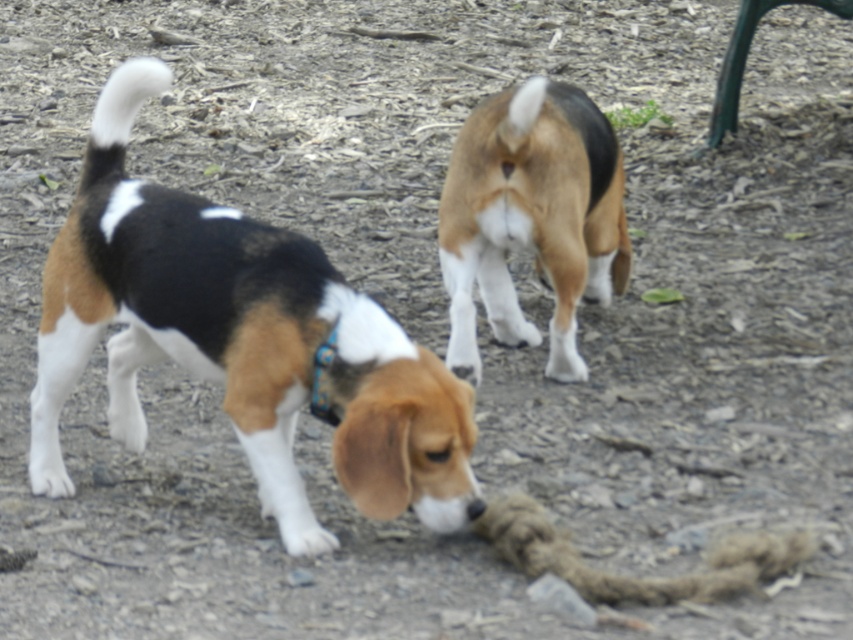
Between tri-color fur beagle at lower left and brown and white fur at center, which one appears on the right side from the viewer's perspective?

From the viewer's perspective, brown and white fur at center appears more on the right side.

Which is behind, point (294, 371) or point (546, 140)?

The point (546, 140) is behind.

At what (x,y) coordinates should I click in order to perform the action: click on tri-color fur beagle at lower left. Please return your answer as a coordinate pair (x, y). Looking at the image, I should click on (239, 340).

Between brown and white fur at center and blue fabric neckband at lower center, which one appears on the right side from the viewer's perspective?

brown and white fur at center

Between point (486, 289) and point (328, 412), which one is positioned in front?

Positioned in front is point (328, 412).

In order to click on brown and white fur at center in this screenshot , I will do `click(531, 218)`.

Does tri-color fur beagle at lower left have a greater width compared to blue fabric neckband at lower center?

Correct, the width of tri-color fur beagle at lower left exceeds that of blue fabric neckband at lower center.

Does tri-color fur beagle at lower left appear on the right side of blue fabric neckband at lower center?

Incorrect, tri-color fur beagle at lower left is not on the right side of blue fabric neckband at lower center.

Who is more forward, (144, 83) or (326, 364)?

Point (326, 364)

Find the location of a particular element. tri-color fur beagle at lower left is located at coordinates (239, 340).